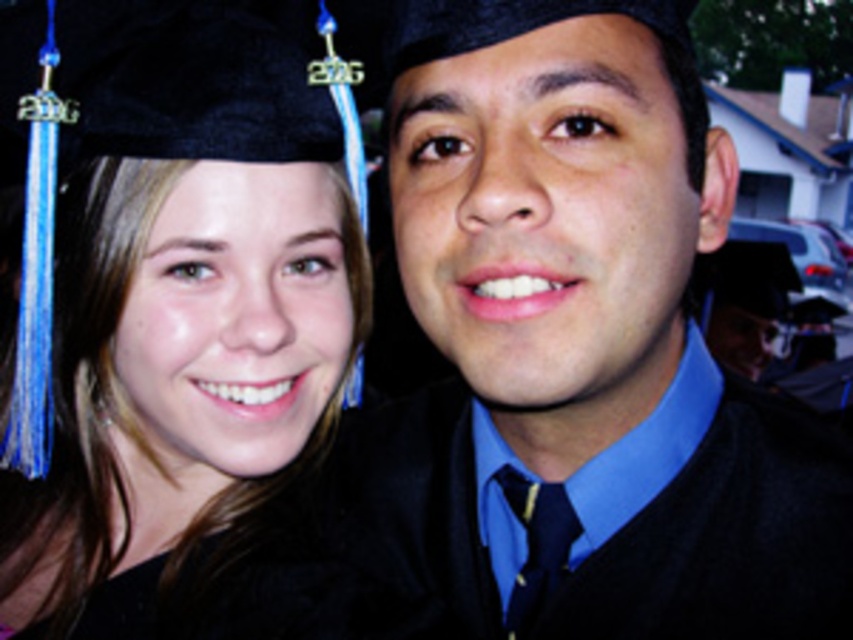
Which is more to the left, matte black graduation cap at upper left or black matte graduation cap at upper left?

From the viewer's perspective, black matte graduation cap at upper left appears more on the left side.

Can you confirm if matte black graduation cap at upper left is positioned below black matte graduation cap at upper left?

Correct, matte black graduation cap at upper left is located below black matte graduation cap at upper left.

I want to click on matte black graduation cap at upper left, so click(x=576, y=339).

Where is `matte black graduation cap at upper left`? This screenshot has width=853, height=640. matte black graduation cap at upper left is located at coordinates (576, 339).

Looking at this image, is matte black graduation cap at upper left thinner than black woolen sweater at right?

Yes.

How much distance is there between matte black graduation cap at upper left and black woolen sweater at right?

The distance of matte black graduation cap at upper left from black woolen sweater at right is 4.96 centimeters.

Is point (529, 380) positioned after point (761, 492)?

No, it is not.

Identify the location of matte black graduation cap at upper left. (576, 339).

What do you see at coordinates (187, 333) in the screenshot? The width and height of the screenshot is (853, 640). I see `black matte graduation cap at upper left` at bounding box center [187, 333].

Who is lower down, black matte graduation cap at upper left or black woolen sweater at right?

black woolen sweater at right is below.

Where is `black matte graduation cap at upper left`? This screenshot has height=640, width=853. black matte graduation cap at upper left is located at coordinates (187, 333).